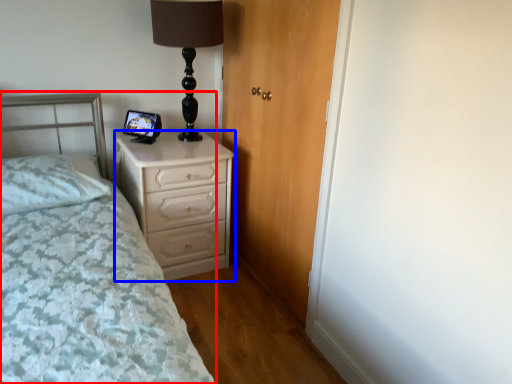
Question: Which of the following is the closest to the observer, bed (highlighted by a red box) or chest of drawers (highlighted by a blue box)?

Choices:
 (A) bed
 (B) chest of drawers

Answer: (A)